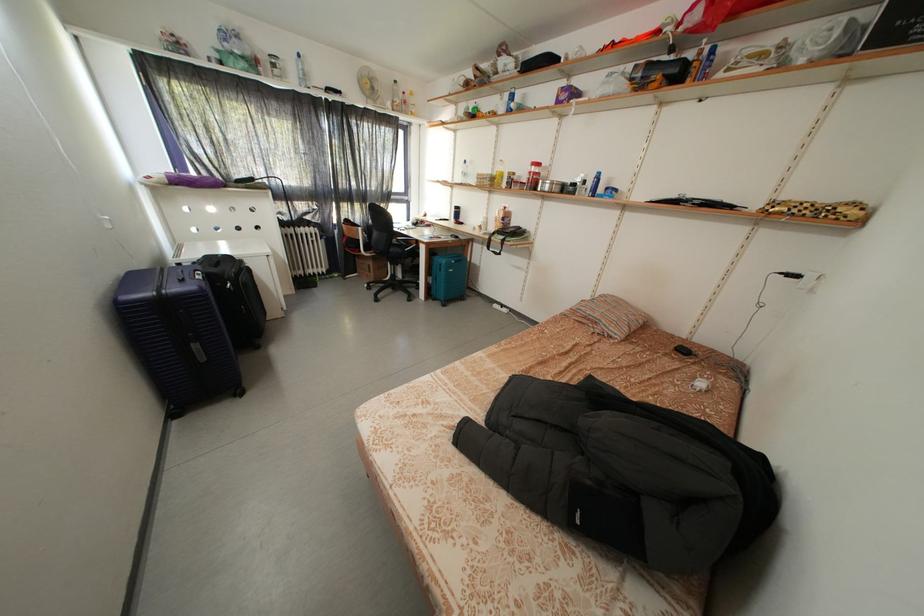
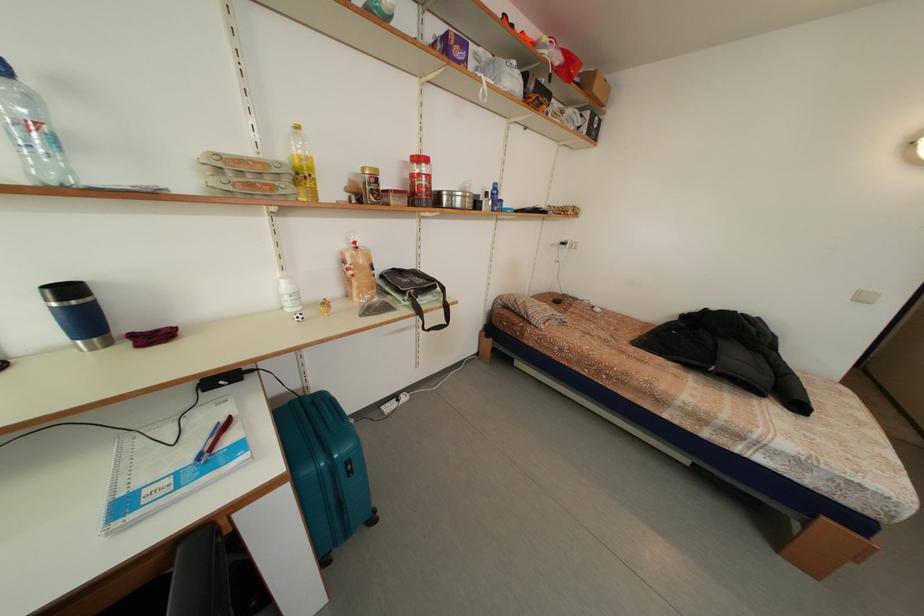
Where in the second image is the point corresponding to [513,213] from the first image?

(362, 248)